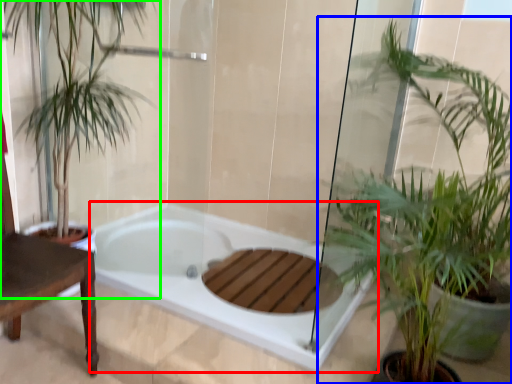
Question: Estimate the real-world distances between objects in this image. Which object is farther from bathtub (highlighted by a red box), houseplant (highlighted by a blue box) or houseplant (highlighted by a green box)?

Choices:
 (A) houseplant
 (B) houseplant

Answer: (A)